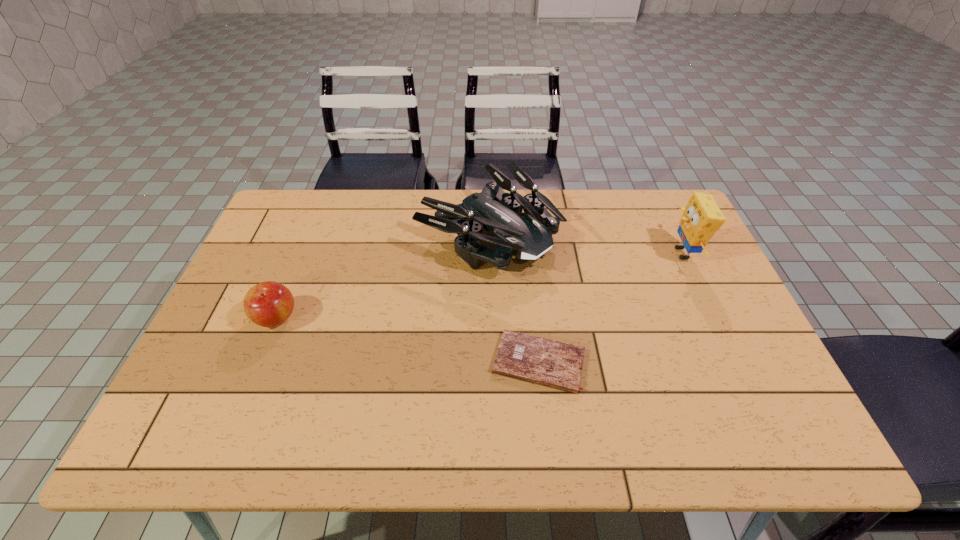
Locate an element on the screen. vacant area at the right edge of the desktop is located at coordinates (708, 350).

In the image, there is a desktop. In order to click on free space at the far left corner in this screenshot , I will do [311, 223].

Locate an element on the screen. vacant space that is in between the leftmost object and the drone is located at coordinates (382, 276).

Locate an element on the screen. This screenshot has height=540, width=960. blank region between the Bible and the drone is located at coordinates (514, 298).

The image size is (960, 540). I want to click on vacant point located between the second shortest object and the shortest object, so click(x=407, y=340).

Find the location of `vacant area that lies between the third tallest object and the drone`. vacant area that lies between the third tallest object and the drone is located at coordinates (382, 276).

Find the location of a particular element. This screenshot has width=960, height=540. vacant space that is in between the apple and the shortest object is located at coordinates (407, 340).

Where is `free space between the Bible and the rightmost object`? The width and height of the screenshot is (960, 540). free space between the Bible and the rightmost object is located at coordinates (611, 308).

I want to click on free space that is in between the second tallest object and the Bible, so click(x=514, y=298).

Image resolution: width=960 pixels, height=540 pixels. In order to click on free space between the drone and the rightmost object in this screenshot , I will do `click(586, 244)`.